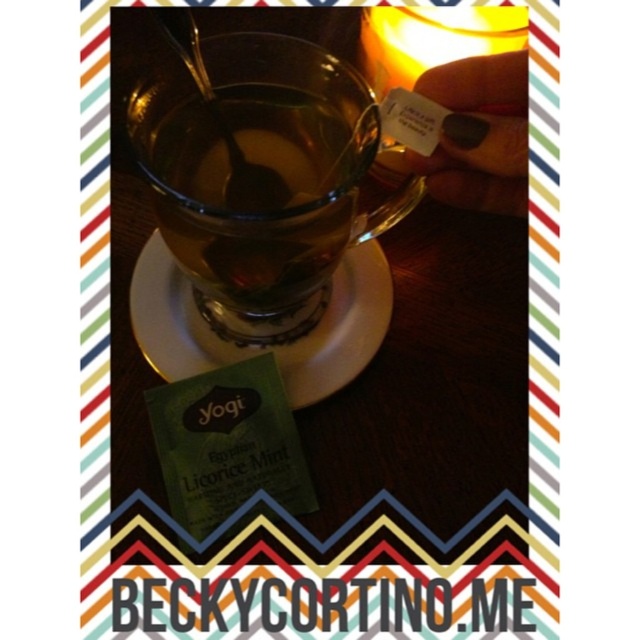
Question: Can you confirm if transparent glass teacup at center is positioned to the left of green paper packet at lower left?

Choices:
 (A) yes
 (B) no

Answer: (B)

Question: Observing the image, what is the correct spatial positioning of transparent glass teacup at center in reference to green paper packet at lower left?

Choices:
 (A) below
 (B) above

Answer: (B)

Question: Which point is farther to the camera?

Choices:
 (A) transparent glass teacup at center
 (B) green paper packet at lower left

Answer: (B)

Question: Which point appears closest to the camera in this image?

Choices:
 (A) (337, 346)
 (B) (284, 113)

Answer: (B)

Question: Is transparent glass teacup at center thinner than green paper packet at lower left?

Choices:
 (A) yes
 (B) no

Answer: (A)